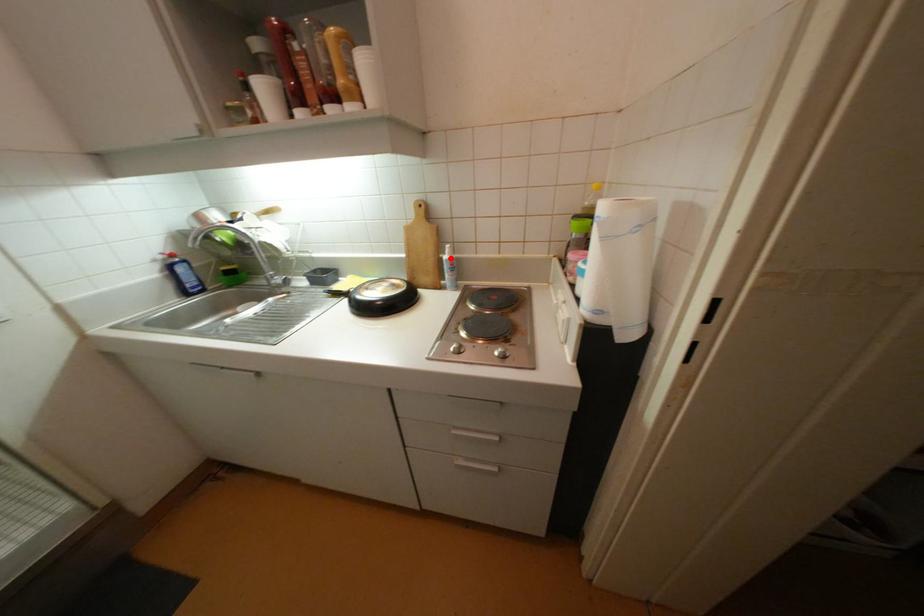
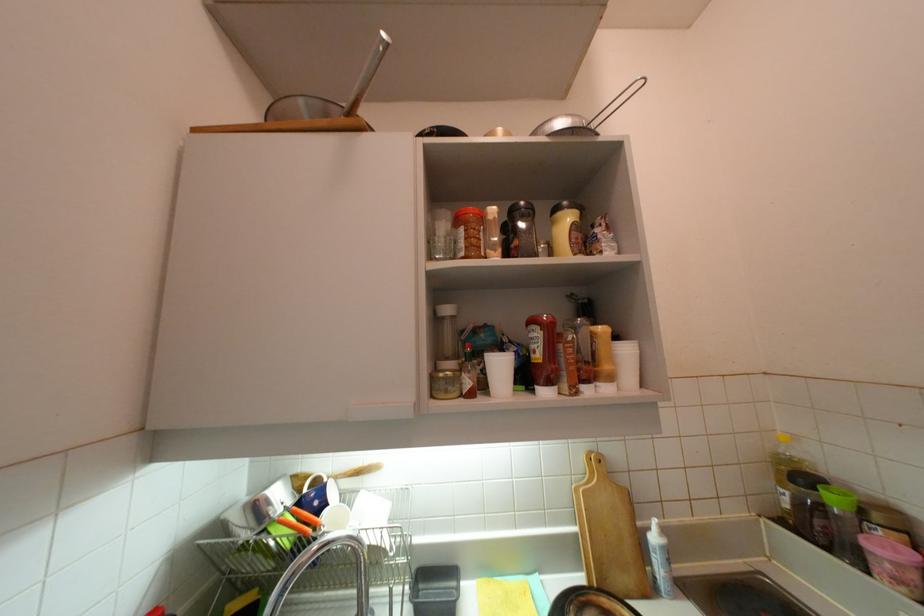
In the second image, find the point that corresponds to the highlighted location in the first image.

(660, 540)